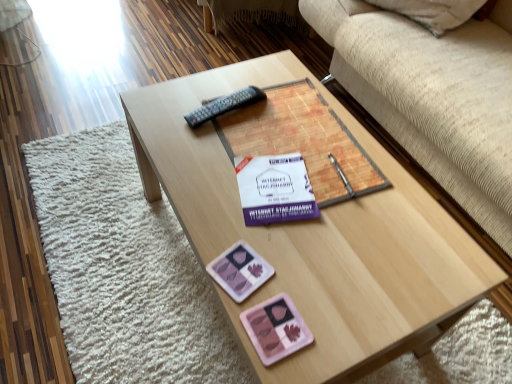
Identify the location of vacant region to the left of white paper at center. (204, 184).